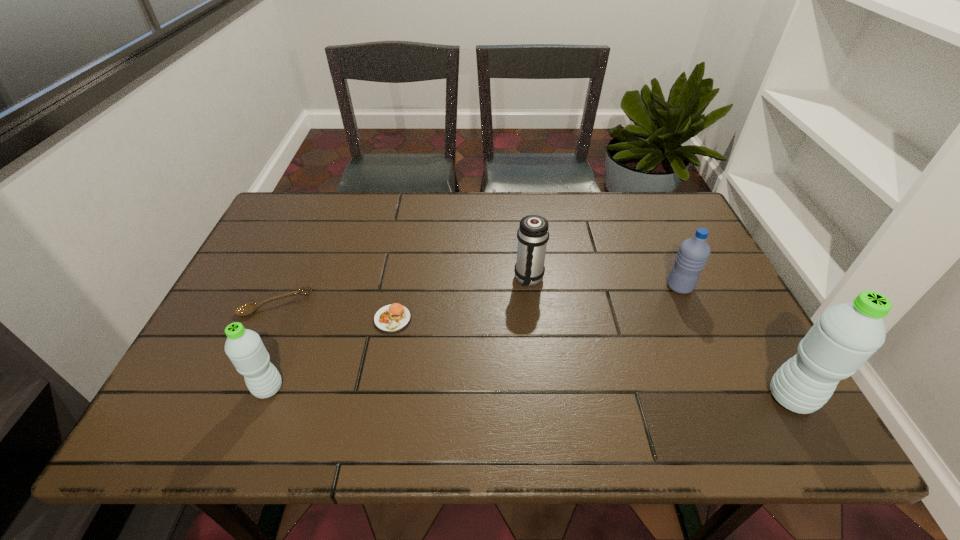
Locate an element on the screen. The image size is (960, 540). free space between the shortest object and the fifth tallest object is located at coordinates (334, 312).

Where is `empty location between the leftmost water bottle and the fourth object from left to right`? This screenshot has width=960, height=540. empty location between the leftmost water bottle and the fourth object from left to right is located at coordinates (398, 334).

Where is `blank region between the fourth object from right to left and the rightmost water bottle`? blank region between the fourth object from right to left and the rightmost water bottle is located at coordinates (591, 358).

Find the location of `empty space between the farthest water bottle and the thermos bottle`. empty space between the farthest water bottle and the thermos bottle is located at coordinates (604, 283).

Identify the location of object that ranks as the third closest to the ladle. (533, 234).

Locate an element on the screen. The image size is (960, 540). the closest object to the leftmost water bottle is located at coordinates (246, 309).

Find the location of a particular element. This screenshot has height=540, width=960. water bottle object that ranks as the second closest to the rightmost object is located at coordinates (244, 347).

Locate which water bottle is the closest to the leftmost water bottle. Please provide its 2D coordinates. Your answer should be formatted as a tuple, i.e. [(x, y)], where the tuple contains the x and y coordinates of a point satisfying the conditions above.

[(693, 253)]

Image resolution: width=960 pixels, height=540 pixels. I want to click on vacant position in the image that satisfies the following two spatial constraints: 1. on the side with the handle of the tallest water bottle; 2. on the right side of the thermos bottle, so click(x=542, y=397).

Find the location of a particular element. vacant space that satisfies the following two spatial constraints: 1. on the front side of the fifth object from left to right; 2. on the right side of the rightmost water bottle is located at coordinates (730, 397).